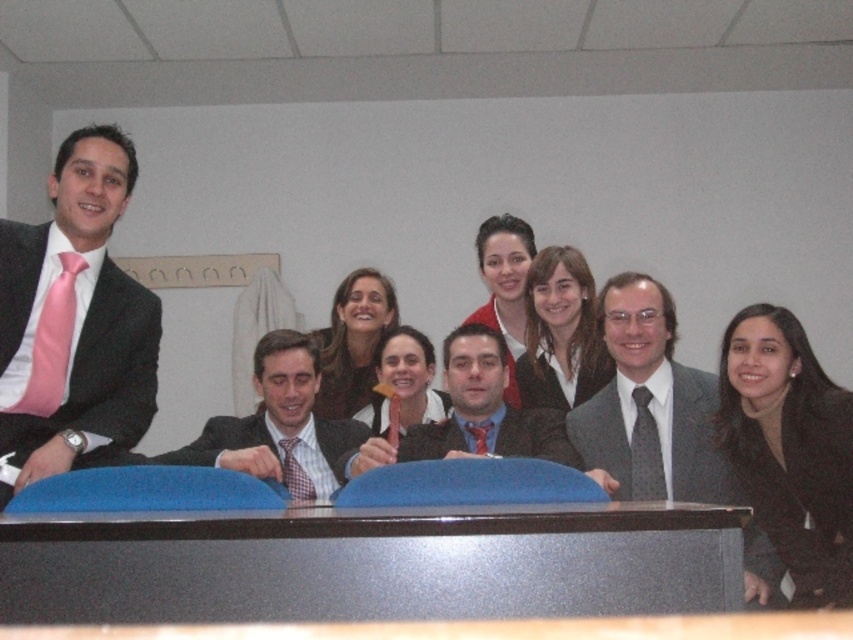
You are organizing a photo shoot and need to arrange the gray textured suit at center and the striped fabric suit at center so that both are visible in the frame. Given their heights, which suit should be placed closer to the camera to ensure both are fully visible?

The gray textured suit at center is taller than the striped fabric suit at center, so to ensure both are fully visible in the frame, the striped fabric suit at center should be placed closer to the camera.

From the picture: You are organizing a photo shoot and need to ensure that all participants are visible in the group photo. The striped fabric suit at center and the matte black suit at center are both at the center of the image. Which of these two suits is more likely to stand out visually in the photo?

The striped fabric suit at center has a larger size compared to matte black suit at center, making it more likely to stand out visually in the photo due to its size difference.

You are a photographer setting up for a group photo. You need to position a light to the left of the striped fabric suit at center. Will the light also be to the left of the gray textured suit at center?

The gray textured suit at center is to the right of the striped fabric suit at center. Therefore, placing the light to the left of the striped fabric suit at center would also place it to the left of the gray textured suit at center since the gray textured suit is positioned to the right of the striped one.